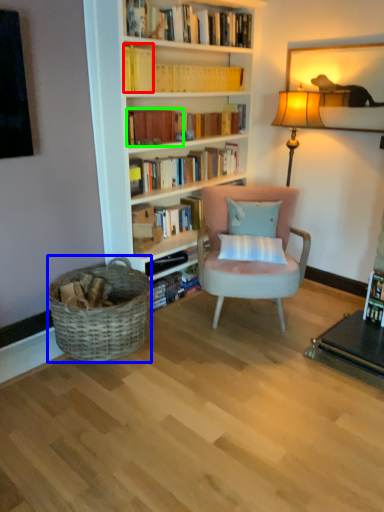
Question: Based on their relative distances, which object is nearer to book (highlighted by a red box)? Choose from picnic basket (highlighted by a blue box) and book (highlighted by a green box).

Choices:
 (A) picnic basket
 (B) book

Answer: (B)